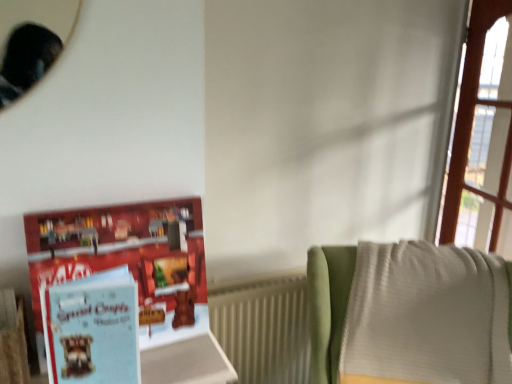
Question: Is light blue paper book at left directly adjacent to light blue paper at left?

Choices:
 (A) yes
 (B) no

Answer: (B)

Question: Considering the relative sizes of light blue paper book at left and light blue paper at left in the image provided, is light blue paper book at left shorter than light blue paper at left?

Choices:
 (A) yes
 (B) no

Answer: (B)

Question: Considering the relative sizes of light blue paper book at left and light blue paper at left in the image provided, is light blue paper book at left bigger than light blue paper at left?

Choices:
 (A) no
 (B) yes

Answer: (B)

Question: From a real-world perspective, is light blue paper book at left below light blue paper at left?

Choices:
 (A) no
 (B) yes

Answer: (A)

Question: Is light blue paper book at left aimed at light blue paper at left?

Choices:
 (A) no
 (B) yes

Answer: (B)

Question: Would you consider light blue paper book at left to be distant from light blue paper at left?

Choices:
 (A) yes
 (B) no

Answer: (B)

Question: Considering the relative sizes of white ribbed radiator at lower right and light blue paper book at left in the image provided, is white ribbed radiator at lower right shorter than light blue paper book at left?

Choices:
 (A) yes
 (B) no

Answer: (B)

Question: Could you tell me if white ribbed radiator at lower right is facing light blue paper book at left?

Choices:
 (A) yes
 (B) no

Answer: (B)

Question: Is white ribbed radiator at lower right to the right of light blue paper book at left from the viewer's perspective?

Choices:
 (A) no
 (B) yes

Answer: (B)

Question: Does white ribbed radiator at lower right come in front of light blue paper book at left?

Choices:
 (A) no
 (B) yes

Answer: (A)

Question: Considering the relative sizes of white ribbed radiator at lower right and light blue paper book at left in the image provided, is white ribbed radiator at lower right bigger than light blue paper book at left?

Choices:
 (A) no
 (B) yes

Answer: (A)

Question: Can you confirm if white ribbed radiator at lower right is wider than light blue paper book at left?

Choices:
 (A) no
 (B) yes

Answer: (A)

Question: From a real-world perspective, is light blue paper book at left on white ribbed radiator at lower right?

Choices:
 (A) no
 (B) yes

Answer: (B)